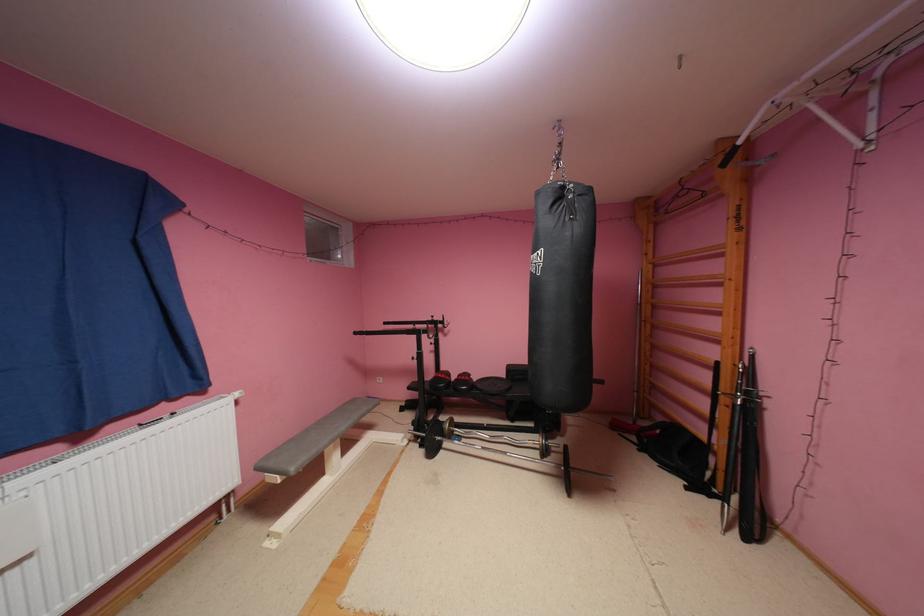
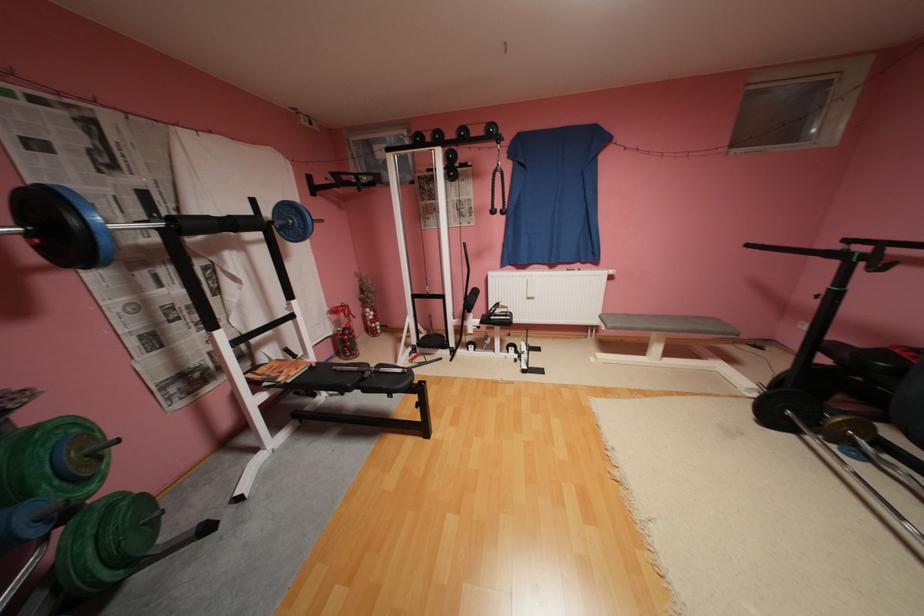
Based on the continuous images, in which direction is the camera rotating?

The rotation direction of the camera is left-down.